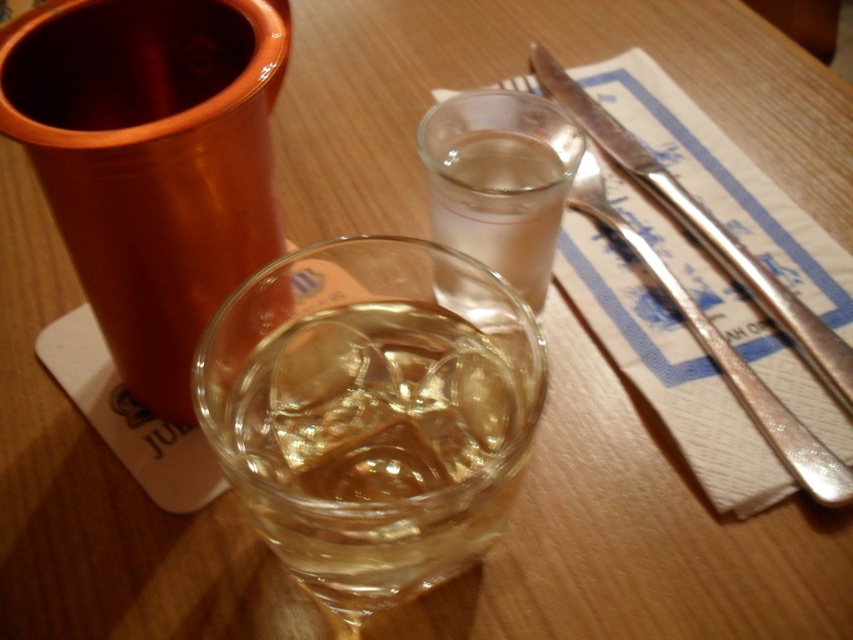
Where is `transparent glass at center`? transparent glass at center is located at coordinates (372, 412).

Between point (457, 525) and point (508, 259), which one is positioned behind?

Positioned behind is point (508, 259).

This screenshot has height=640, width=853. Find the location of `transparent glass at center`. transparent glass at center is located at coordinates (372, 412).

Identify the location of transparent glass at center. The height and width of the screenshot is (640, 853). (372, 412).

Is clear glass at upper center behind polished metal knife at upper right?

No, clear glass at upper center is closer to the viewer.

How much distance is there between clear glass at upper center and polished metal knife at upper right?

3.15 inches

Which is in front, point (509, 145) or point (718, 248)?

Point (509, 145)

Where is `clear glass at upper center`? clear glass at upper center is located at coordinates (500, 180).

This screenshot has width=853, height=640. I want to click on transparent glass at center, so click(x=372, y=412).

Consider the image. Is the position of transparent glass at center less distant than that of polished metal knife at upper right?

Yes.

Which is behind, point (407, 417) or point (553, 88)?

Positioned behind is point (553, 88).

Locate an element on the screen. transparent glass at center is located at coordinates (372, 412).